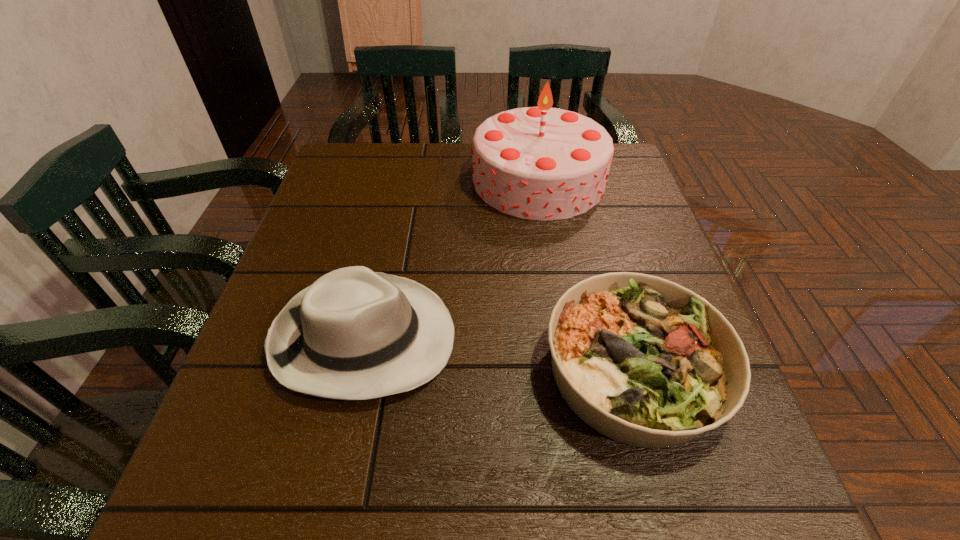
The height and width of the screenshot is (540, 960). I want to click on vacant area between the shortest object and the second tallest object, so click(x=499, y=354).

Where is `object that is the second closest to the farthest object`? object that is the second closest to the farthest object is located at coordinates (644, 361).

Locate which object ranks second in proximity to the fedora. Please provide its 2D coordinates. Your answer should be formatted as a tuple, i.e. [(x, y)], where the tuple contains the x and y coordinates of a point satisfying the conditions above.

[(540, 163)]

You are a GUI agent. You are given a task and a screenshot of the screen. Output one action in this format:
    pyautogui.click(x=<x>, y=<y>)
    Task: Click on the vacant area in the image that satisfies the following two spatial constraints: 1. on the back side of the shortest object; 2. on the front-facing side of the second shortest object
    Image resolution: width=960 pixels, height=540 pixels.
    Given the screenshot: What is the action you would take?
    [624, 338]

You are a GUI agent. You are given a task and a screenshot of the screen. Output one action in this format:
    pyautogui.click(x=<x>, y=<y>)
    Task: Click on the vacant region that satisfies the following two spatial constraints: 1. on the front-facing side of the fedora; 2. on the back side of the salad plate
    This screenshot has width=960, height=540.
    Given the screenshot: What is the action you would take?
    pyautogui.click(x=357, y=370)

Where is `vacant area in the image that satisfies the following two spatial constraints: 1. on the front side of the farthest object; 2. on the left side of the salad plate`? This screenshot has width=960, height=540. vacant area in the image that satisfies the following two spatial constraints: 1. on the front side of the farthest object; 2. on the left side of the salad plate is located at coordinates (569, 370).

At what (x,y) coordinates should I click in order to perform the action: click on vacant space that satisfies the following two spatial constraints: 1. on the back side of the shortest object; 2. on the front-facing side of the second shortest object. Please return your answer as a coordinate pair (x, y). Looking at the image, I should click on (624, 338).

Find the location of a particular element. vacant region that satisfies the following two spatial constraints: 1. on the front-facing side of the leftmost object; 2. on the left side of the salad plate is located at coordinates (357, 370).

What are the coordinates of `free location that satisfies the following two spatial constraints: 1. on the front-facing side of the salad plate; 2. on the left side of the leftmost object` in the screenshot? It's located at (357, 370).

You are a GUI agent. You are given a task and a screenshot of the screen. Output one action in this format:
    pyautogui.click(x=<x>, y=<y>)
    Task: Click on the free point that satisfies the following two spatial constraints: 1. on the front side of the salad plate; 2. on the left side of the farthest object
    
    Given the screenshot: What is the action you would take?
    coord(569,370)